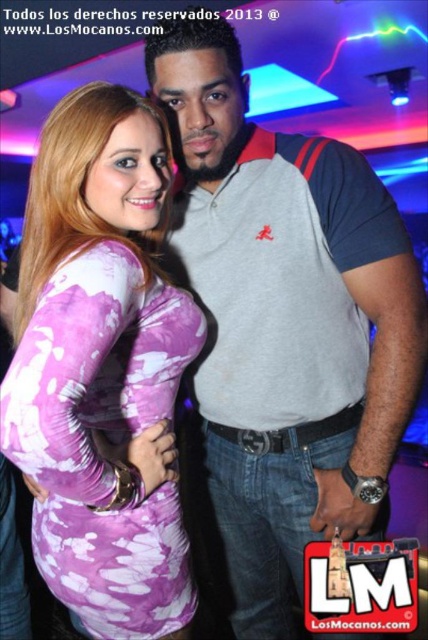
Question: Can you confirm if gray cotton polo shirt at center is thinner than purple tie-dye dress at center?

Choices:
 (A) no
 (B) yes

Answer: (A)

Question: Which object is farther from the camera taking this photo?

Choices:
 (A) purple tie-dye dress at center
 (B) gray cotton polo shirt at center

Answer: (B)

Question: Can you confirm if gray cotton polo shirt at center is positioned to the right of purple tie-dye dress at center?

Choices:
 (A) no
 (B) yes

Answer: (B)

Question: Does gray cotton polo shirt at center have a lesser width compared to purple tie-dye dress at center?

Choices:
 (A) no
 (B) yes

Answer: (A)

Question: Which of the following is the closest to the observer?

Choices:
 (A) (389, 259)
 (B) (169, 481)

Answer: (B)